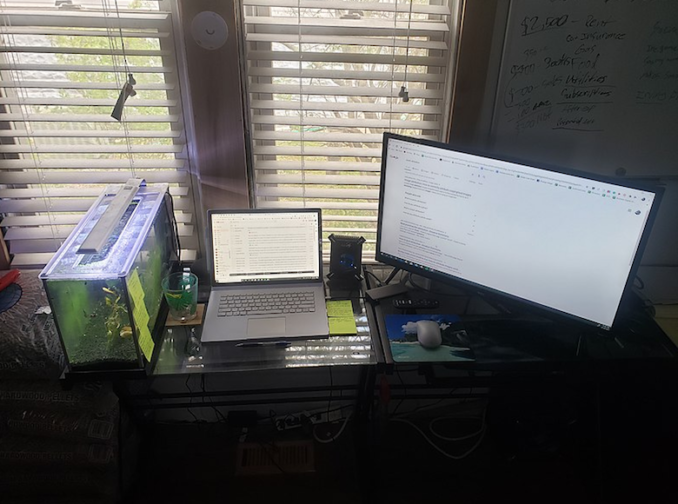
This screenshot has width=678, height=504. In order to click on glass in this screenshot , I will do `click(182, 294)`.